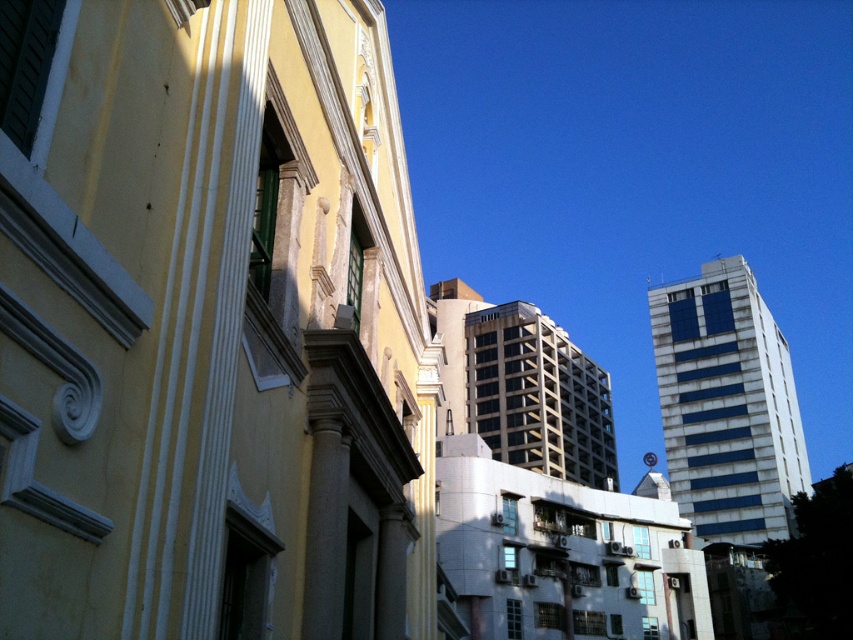
Can you confirm if blue glass building at upper right is positioned above beige concrete building at center?

Yes, blue glass building at upper right is above beige concrete building at center.

Is point (773, 353) farther from camera compared to point (569, 474)?

Yes, it is.

Where is `blue glass building at upper right`? blue glass building at upper right is located at coordinates (727, 404).